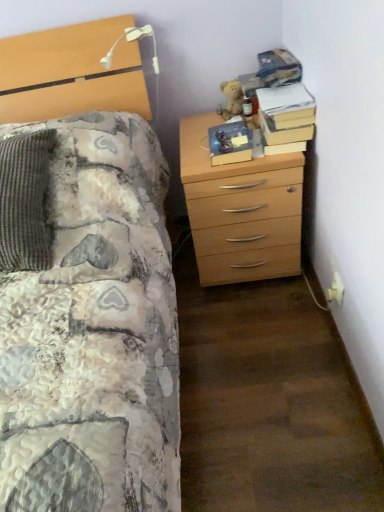
I want to click on vacant space in front of light wood chest of drawers at right, so click(x=255, y=329).